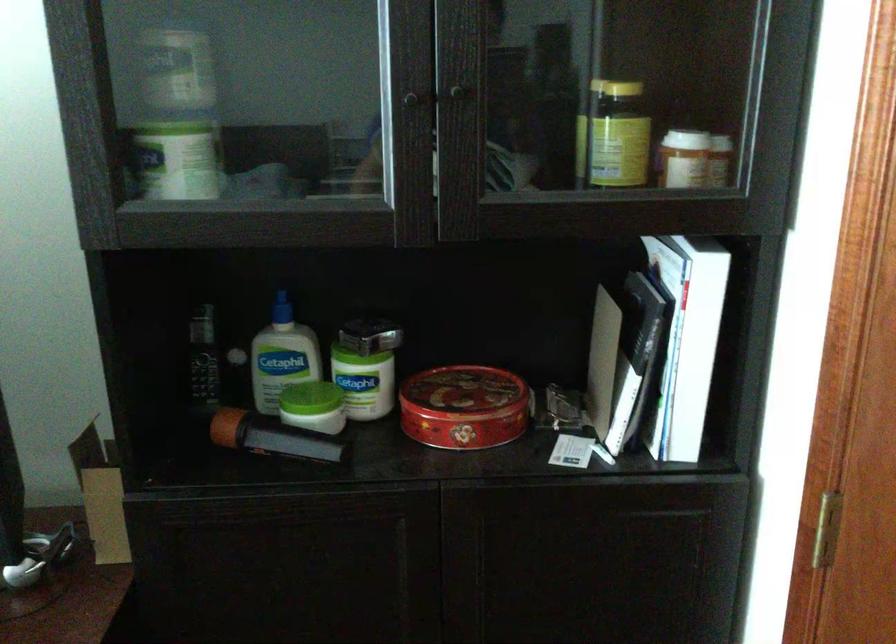
Image resolution: width=896 pixels, height=644 pixels. Find the location of `small green lid`. small green lid is located at coordinates (309, 398).